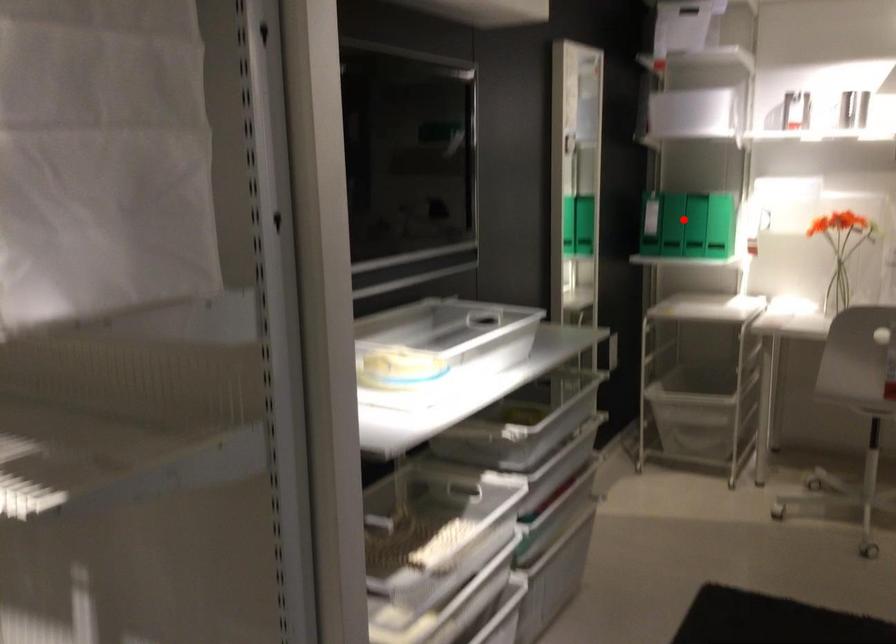
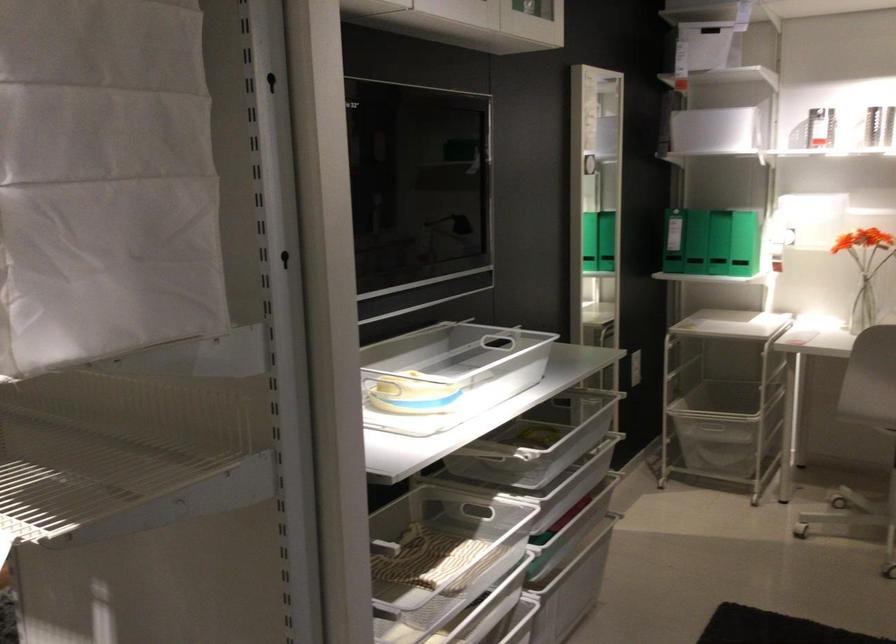
In the second image, find the point that corresponds to the highlighted location in the first image.

(695, 242)